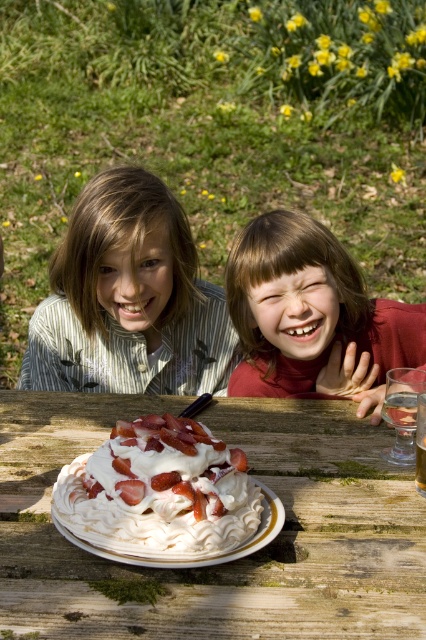
Is point (184, 250) positioned behind point (403, 403)?

Yes.

Does striped shirt at center have a smaller size compared to clear glass at table center?

No, striped shirt at center is not smaller than clear glass at table center.

Which is in front, point (120, 323) or point (382, 410)?

Point (382, 410) is more forward.

At what (x,y) coordinates should I click in order to perform the action: click on striped shirt at center. Please return your answer as a coordinate pair (x, y). The height and width of the screenshot is (640, 426). Looking at the image, I should click on (129, 300).

Which of these two, white wooden table at center or clear glass water at table center, stands taller?

Standing taller between the two is white wooden table at center.

Who is positioned more to the right, white wooden table at center or clear glass water at table center?

From the viewer's perspective, clear glass water at table center appears more on the right side.

Which is behind, point (302, 618) or point (423, 444)?

The point (423, 444) is behind.

Locate an element on the screen. This screenshot has width=426, height=640. white wooden table at center is located at coordinates (229, 563).

Who is positioned more to the left, white wooden table at center or white fluffy frosting at center?

white fluffy frosting at center is more to the left.

Between white wooden table at center and white fluffy frosting at center, which one is positioned higher?

white fluffy frosting at center is above.

At what (x,y) coordinates should I click in order to perform the action: click on white wooden table at center. Please return your answer as a coordinate pair (x, y). The width and height of the screenshot is (426, 640). Looking at the image, I should click on (229, 563).

At what (x,y) coordinates should I click in order to perform the action: click on white wooden table at center. Please return your answer as a coordinate pair (x, y). Looking at the image, I should click on (229, 563).